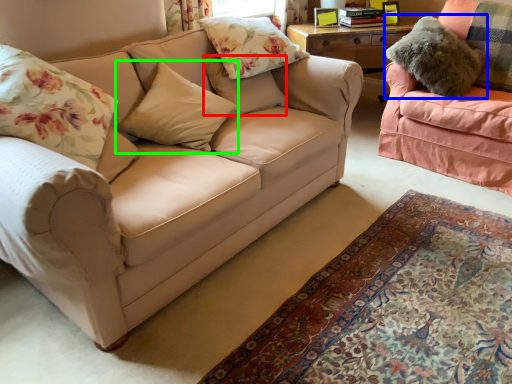
Question: Based on their relative distances, which object is farther from pillow (highlighted by a red box)? Choose from pillow (highlighted by a blue box) and pillow (highlighted by a green box).

Choices:
 (A) pillow
 (B) pillow

Answer: (A)